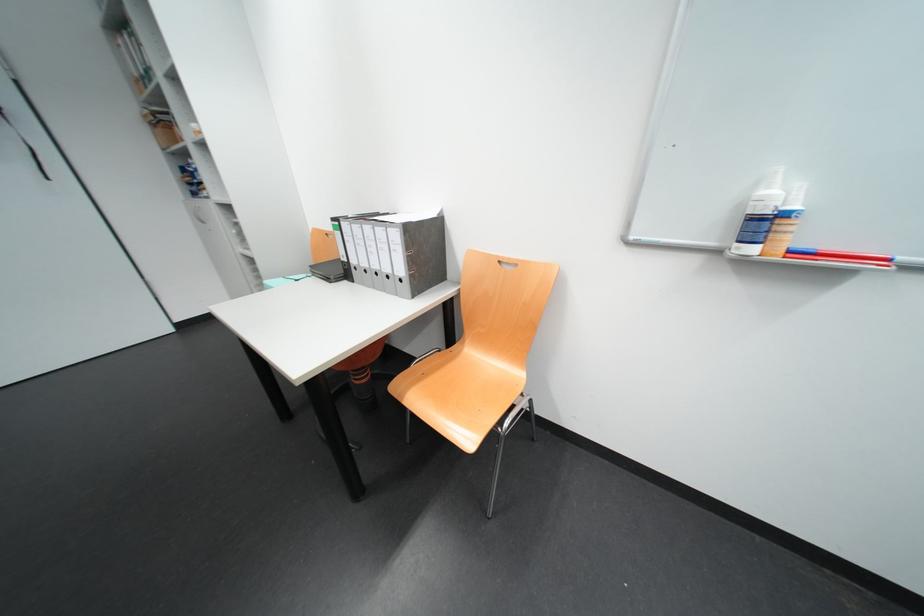
What do you see at coordinates (478, 392) in the screenshot?
I see `a wooden chair sitting surface` at bounding box center [478, 392].